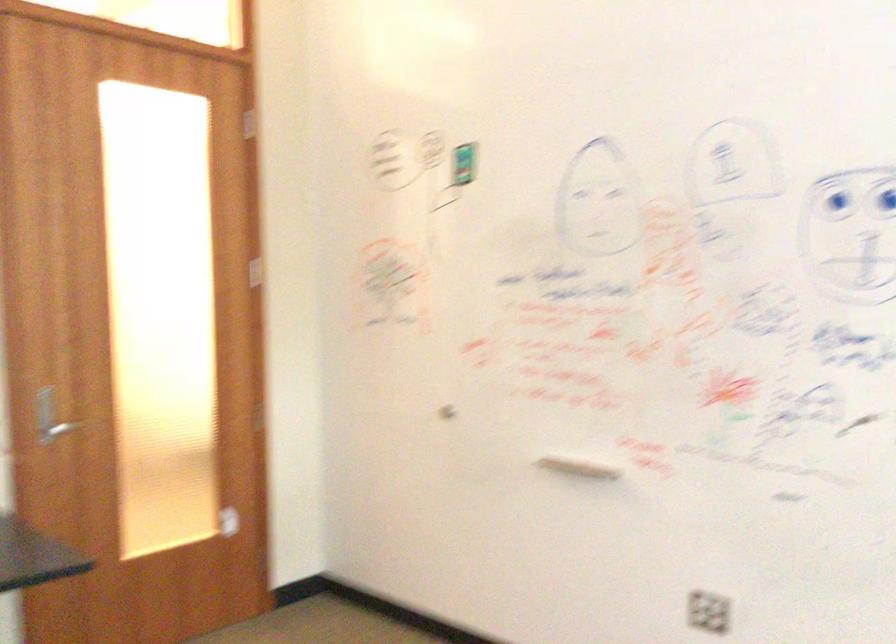
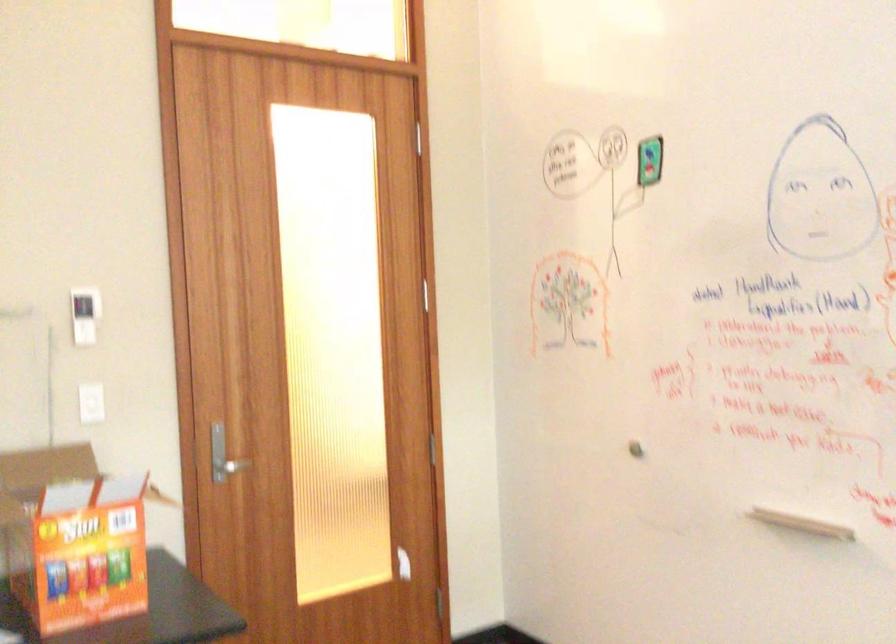
Question: The images are taken continuously from a first-person perspective. In which direction is your viewpoint rotating?

Choices:
 (A) Left
 (B) Right
 (C) Up
 (D) Down

Answer: (A)